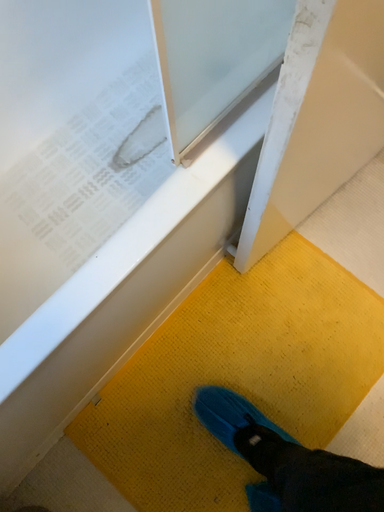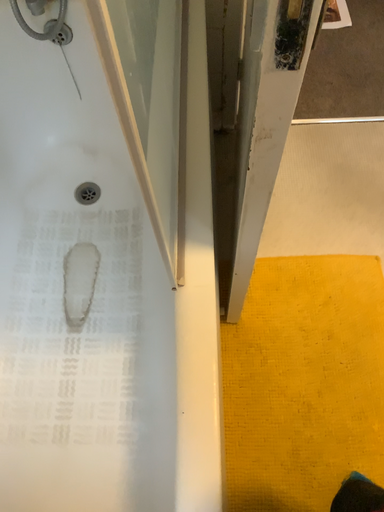
Question: How did the camera likely rotate when shooting the video?

Choices:
 (A) rotated upward
 (B) rotated downward

Answer: (A)